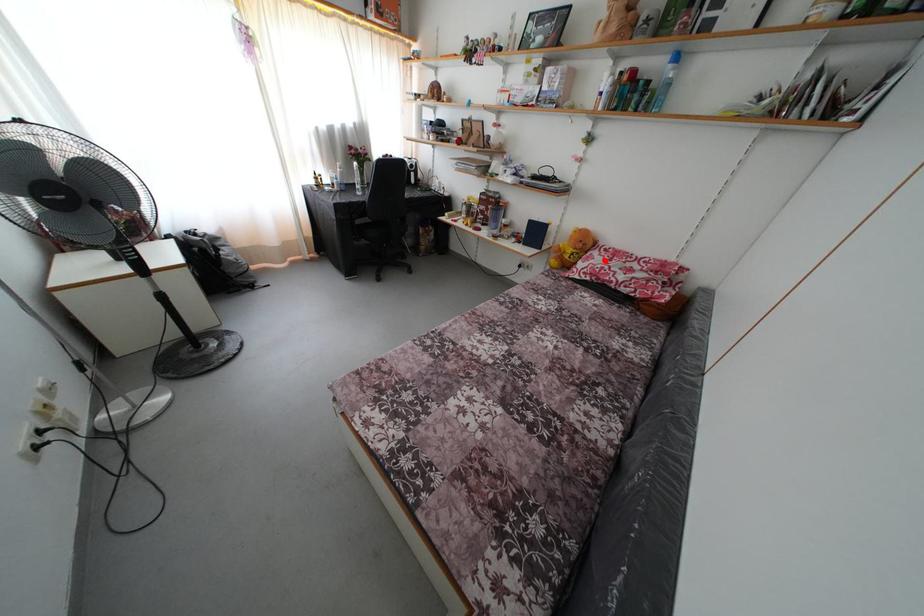
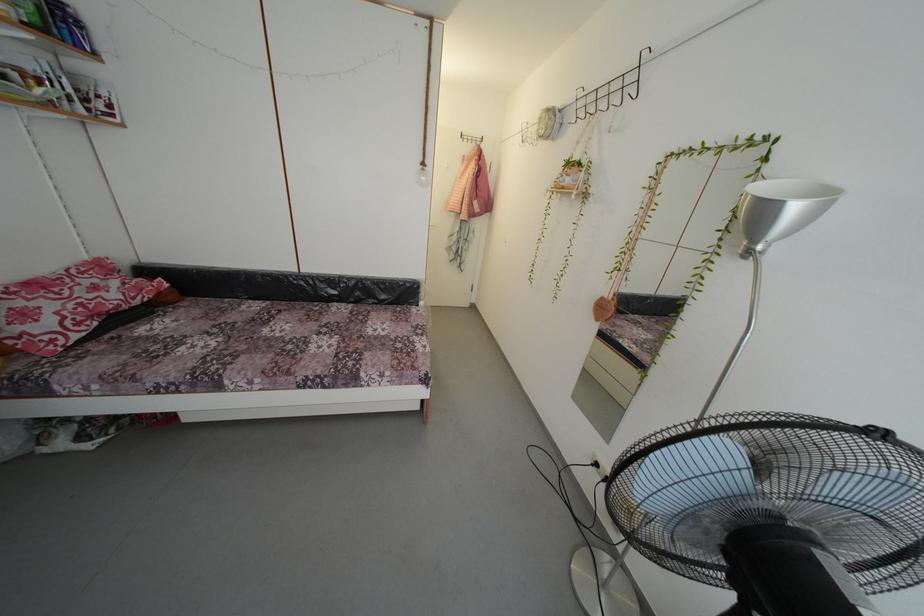
Find the pixel in the second image that matches the highlighted location in the first image.

(34, 306)